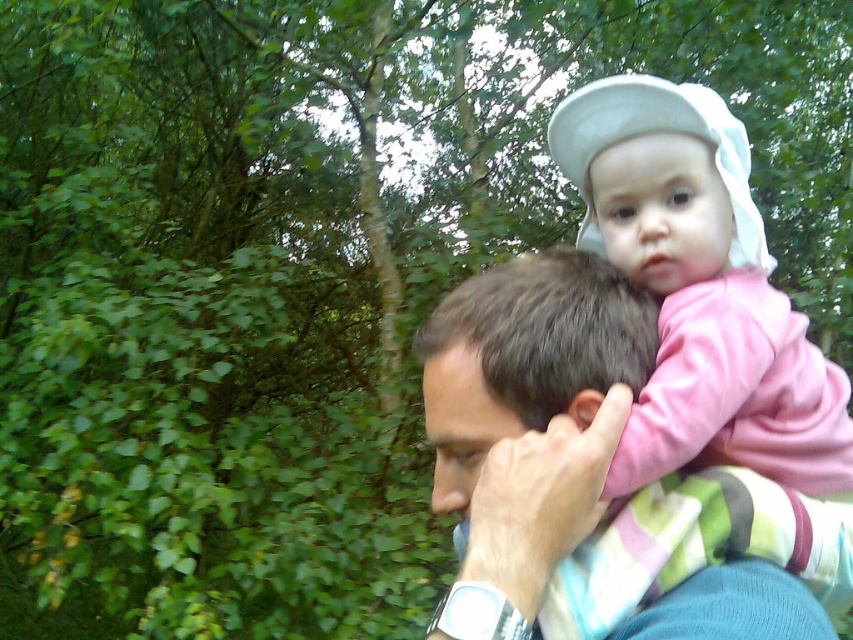
Question: Does dark brown hair at center appear on the right side of blue knitted sweater at upper right?

Choices:
 (A) no
 (B) yes

Answer: (A)

Question: Among these objects, which one is farthest from the camera?

Choices:
 (A) pink fabric baby at upper right
 (B) dark brown hair at center

Answer: (A)

Question: Is smooth blue shirt at center in front of blue knitted sweater at upper right?

Choices:
 (A) yes
 (B) no

Answer: (B)

Question: Is pink fabric baby at upper right in front of smooth blue shirt at center?

Choices:
 (A) no
 (B) yes

Answer: (A)

Question: Based on their relative distances, which object is farther from the pink fabric baby at upper right?

Choices:
 (A) dark brown hair at center
 (B) blue knitted sweater at upper right

Answer: (B)

Question: Which of the following is the farthest from the observer?

Choices:
 (A) (422, 364)
 (B) (630, 525)
 (C) (659, 257)
 (D) (634, 628)

Answer: (A)